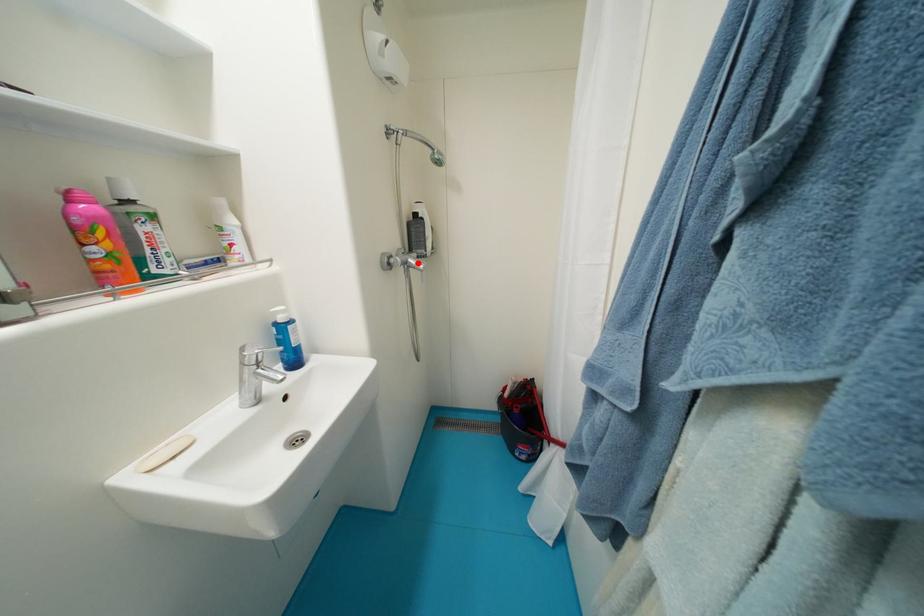
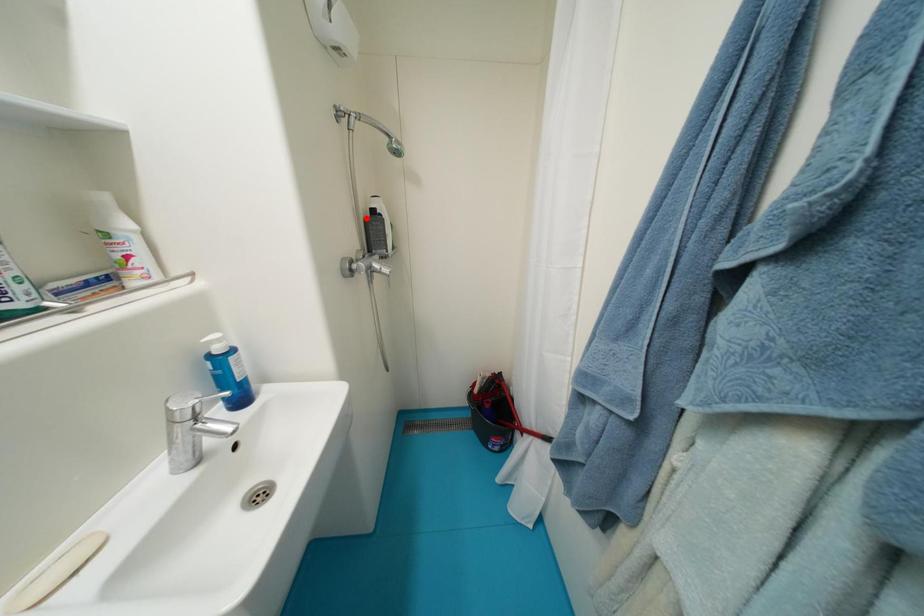
I am providing you with two images of the same scene from different viewpoints. A red point is marked on the first image and another point is marked on the second image. Is the marked point in image1 the same physical position as the marked point in image2?

No